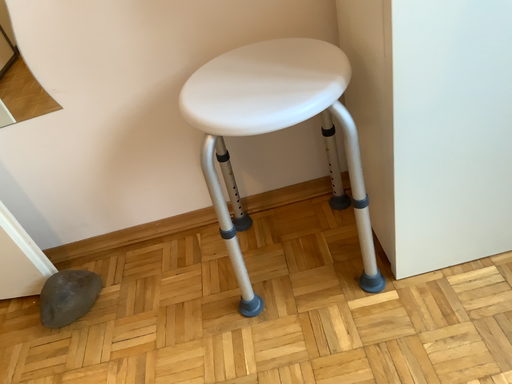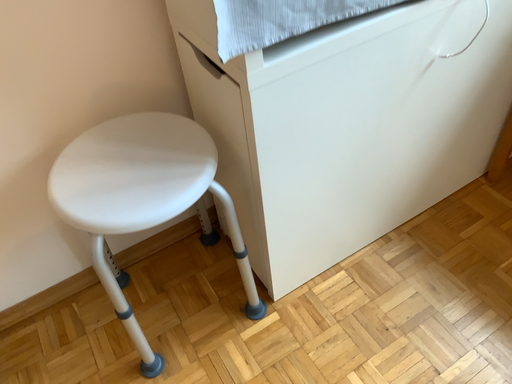
Question: How did the camera likely rotate when shooting the video?

Choices:
 (A) rotated right
 (B) rotated left

Answer: (A)